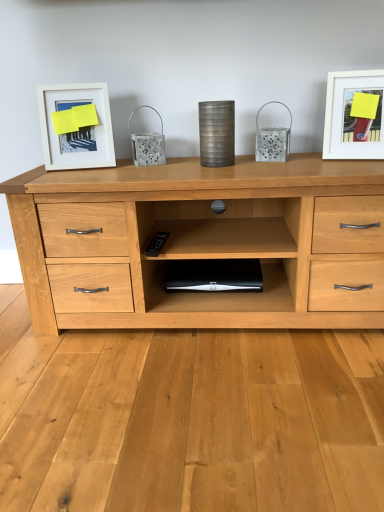
Question: Relative to white matte picture frame at upper right, which is the 1th picture frame in right-to-left order, is black plastic computer at center in front or behind?

Choices:
 (A) behind
 (B) front

Answer: (A)

Question: Considering the positions of black plastic computer at center and white matte picture frame at upper right, the 2th picture frame positioned from the left, in the image, is black plastic computer at center wider or thinner than white matte picture frame at upper right, the 2th picture frame positioned from the left,?

Choices:
 (A) thin
 (B) wide

Answer: (B)

Question: Which is farther from the white matte picture frame at upper left, arranged as the first picture frame when viewed from the left?

Choices:
 (A) white matte picture frame at upper right, the 2th picture frame positioned from the left
 (B) black plastic computer at center

Answer: (A)

Question: Based on their relative distances, which object is nearer to the black plastic computer at center?

Choices:
 (A) white matte picture frame at upper left, acting as the 2th picture frame starting from the right
 (B) white matte picture frame at upper right, which is the 1th picture frame in right-to-left order

Answer: (A)